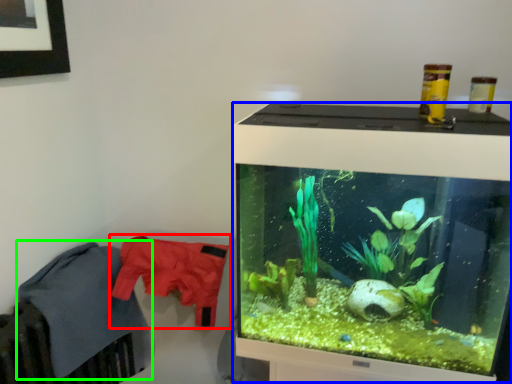
Question: Which is farther away from clothing (highlighted by a red box)? computer monitor (highlighted by a blue box) or clothing (highlighted by a green box)?

Choices:
 (A) computer monitor
 (B) clothing

Answer: (A)